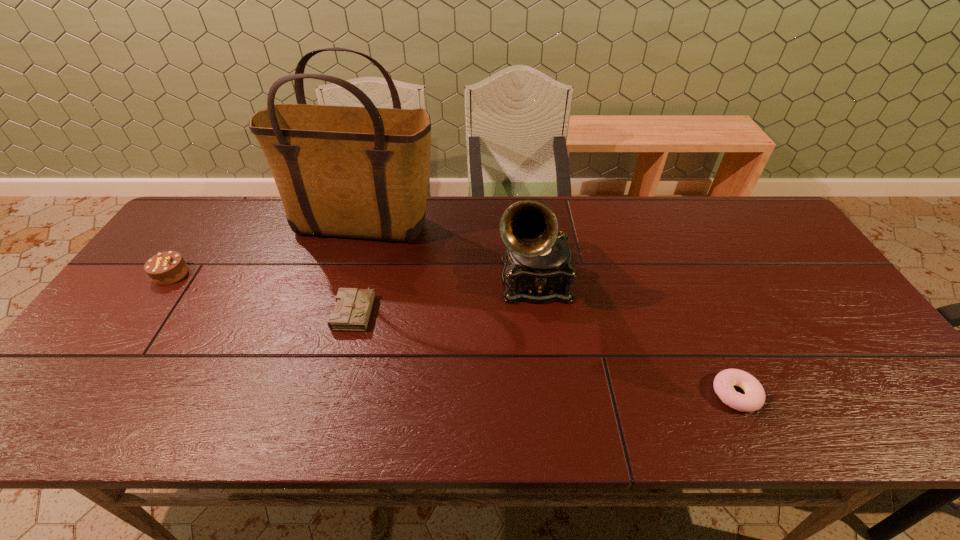
Identify the location of vacant space located on the horn of the phonograph record. The width and height of the screenshot is (960, 540). (542, 358).

The width and height of the screenshot is (960, 540). What are the coordinates of `vacant region located on the back of the leftmost object` in the screenshot? It's located at (199, 234).

The height and width of the screenshot is (540, 960). I want to click on vacant space positioned 0.050m on the front of the diary, so click(x=345, y=349).

You are a GUI agent. You are given a task and a screenshot of the screen. Output one action in this format:
    pyautogui.click(x=<x>, y=<y>)
    Task: Click on the blank space located 0.240m on the left of the rightmost object
    This screenshot has height=540, width=960.
    Given the screenshot: What is the action you would take?
    pyautogui.click(x=605, y=394)

Locate an element on the screen. This screenshot has height=540, width=960. object that is at the far edge is located at coordinates (362, 172).

Find the location of a particular element. object situated at the near edge is located at coordinates (753, 399).

Locate an element on the screen. Image resolution: width=960 pixels, height=540 pixels. object at the left edge is located at coordinates (168, 267).

The height and width of the screenshot is (540, 960). In order to click on free region at the far edge of the desktop in this screenshot , I will do `click(650, 235)`.

Locate an element on the screen. blank area at the near edge is located at coordinates (633, 427).

In the image, there is a desktop. Where is `free space at the left edge`? The width and height of the screenshot is (960, 540). free space at the left edge is located at coordinates (114, 385).